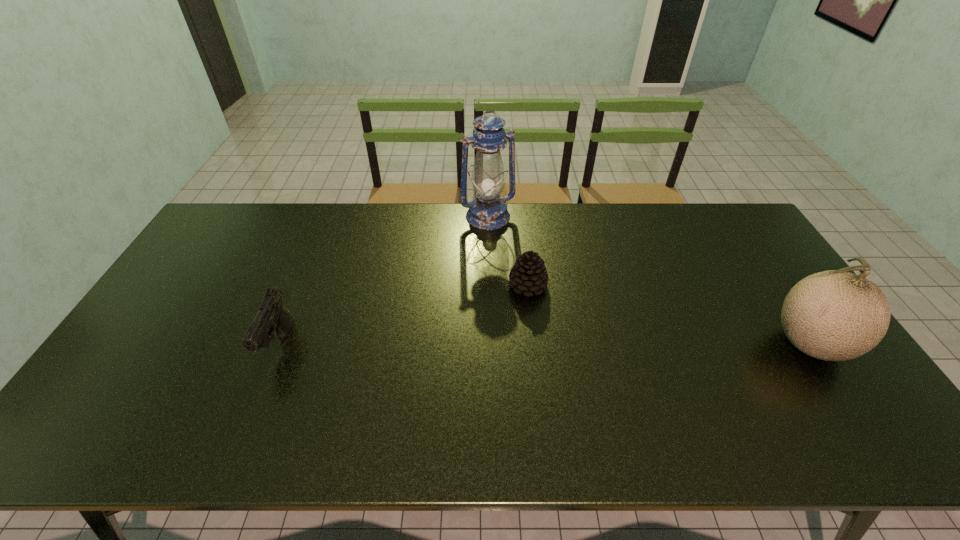
This screenshot has width=960, height=540. In order to click on vacant space located at the narrow end of the third nearest object in this screenshot , I will do [584, 343].

This screenshot has width=960, height=540. In order to click on blank space located at the narrow end of the third nearest object in this screenshot , I will do `click(567, 326)`.

You are a GUI agent. You are given a task and a screenshot of the screen. Output one action in this format:
    pyautogui.click(x=<x>, y=<y>)
    Task: Click on the vacant space situated at the narrow end of the third nearest object
    This screenshot has width=960, height=540.
    Given the screenshot: What is the action you would take?
    pyautogui.click(x=610, y=369)

Image resolution: width=960 pixels, height=540 pixels. Find the location of `object present at the far edge`. object present at the far edge is located at coordinates (487, 211).

Locate an element on the screen. The image size is (960, 540). object that is at the near edge is located at coordinates (834, 315).

This screenshot has height=540, width=960. In order to click on object at the right edge in this screenshot , I will do `click(834, 315)`.

I want to click on object located at the near right corner, so click(834, 315).

Locate an element on the screen. free space at the far edge of the desktop is located at coordinates (673, 228).

In the image, there is a desktop. At what (x,y) coordinates should I click in order to perform the action: click on vacant space at the near edge. Please return your answer as a coordinate pair (x, y). Image resolution: width=960 pixels, height=540 pixels. Looking at the image, I should click on [601, 391].

In order to click on free space at the left edge of the desktop in this screenshot , I will do `click(166, 307)`.